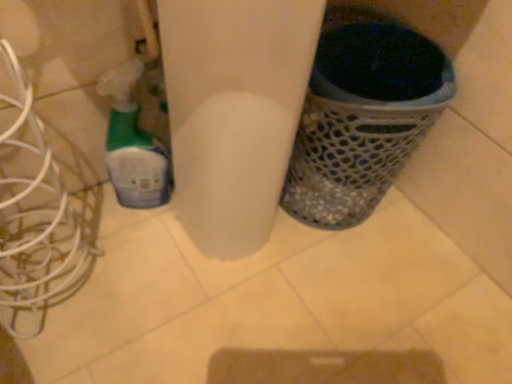
What do you see at coordinates (352, 156) in the screenshot? I see `metallic mesh waste bin at right` at bounding box center [352, 156].

The height and width of the screenshot is (384, 512). Find the location of `translucent plastic spray bottle at left`. translucent plastic spray bottle at left is located at coordinates [133, 143].

From the image's perspective, which one is positioned higher, translucent plastic spray bottle at left or metallic mesh waste bin at right?

metallic mesh waste bin at right.

Locate an element on the screen. This screenshot has width=512, height=384. waste container in front of the translucent plastic spray bottle at left is located at coordinates (352, 156).

Is point (111, 137) behind point (329, 200)?

That is False.

Which is more to the right, translucent plastic spray bottle at left or metallic mesh waste bin at right?

From the viewer's perspective, metallic mesh waste bin at right appears more on the right side.

From the picture: Is metallic mesh waste bin at right oriented towards white metallic wires at left?

No.

From a real-world perspective, which object stands above the other?

In real-world perspective, white metallic wires at left is above.

Based on the photo, is the surface of metallic mesh waste bin at right in direct contact with white metallic wires at left?

There is a gap between metallic mesh waste bin at right and white metallic wires at left.

Is metallic mesh waste bin at right thinner than white metallic wires at left?

In fact, metallic mesh waste bin at right might be wider than white metallic wires at left.

Considering the relative sizes of white metallic wires at left and metallic mesh waste bin at right in the image provided, is white metallic wires at left bigger than metallic mesh waste bin at right?

No.

Which of these two, white metallic wires at left or metallic mesh waste bin at right, stands shorter?

metallic mesh waste bin at right.

Are white metallic wires at left and metallic mesh waste bin at right located far from each other?

No, white metallic wires at left is not far from metallic mesh waste bin at right.

Considering the sizes of white metallic wires at left and translucent plastic spray bottle at left in the image, is white metallic wires at left bigger or smaller than translucent plastic spray bottle at left?

white metallic wires at left is bigger than translucent plastic spray bottle at left.

Is point (52, 269) farther from viewer compared to point (110, 144)?

Yes.

Is white metallic wires at left located outside translucent plastic spray bottle at left?

white metallic wires at left is positioned outside translucent plastic spray bottle at left.

Is white metallic wires at left facing away from translucent plastic spray bottle at left?

No.

Can you confirm if translucent plastic spray bottle at left is taller than white metallic wires at left?

In fact, translucent plastic spray bottle at left may be shorter than white metallic wires at left.

Is translucent plastic spray bottle at left directly adjacent to white metallic wires at left?

translucent plastic spray bottle at left and white metallic wires at left are not in contact.

The width and height of the screenshot is (512, 384). Identify the location of wire that is in front of the translucent plastic spray bottle at left. tap(35, 216).

Locate an element on the screen. This screenshot has height=384, width=512. waste container above the translucent plastic spray bottle at left (from a real-world perspective) is located at coordinates (352, 156).

Visually, is metallic mesh waste bin at right positioned to the left or to the right of translucent plastic spray bottle at left?

In the image, metallic mesh waste bin at right appears on the right side of translucent plastic spray bottle at left.

Considering the sizes of objects metallic mesh waste bin at right and translucent plastic spray bottle at left in the image provided, who is taller, metallic mesh waste bin at right or translucent plastic spray bottle at left?

Standing taller between the two is metallic mesh waste bin at right.

In the scene shown: Between metallic mesh waste bin at right and translucent plastic spray bottle at left, which one is positioned in front?

metallic mesh waste bin at right.

Find the location of a particular element. This screenshot has width=512, height=384. waste container in front of the translucent plastic spray bottle at left is located at coordinates (352, 156).

In the image, there is a white metallic wires at left. At what (x,y) coordinates should I click in order to perform the action: click on waste container below it (from a real-world perspective). Please return your answer as a coordinate pair (x, y). The width and height of the screenshot is (512, 384). Looking at the image, I should click on (352, 156).

Based on their spatial positions, is metallic mesh waste bin at right or white metallic wires at left closer to translucent plastic spray bottle at left?

The object closer to translucent plastic spray bottle at left is white metallic wires at left.

When comparing their distances from translucent plastic spray bottle at left, does white metallic wires at left or metallic mesh waste bin at right seem closer?

Based on the image, white metallic wires at left appears to be nearer to translucent plastic spray bottle at left.

Based on their spatial positions, is translucent plastic spray bottle at left or white metallic wires at left further from metallic mesh waste bin at right?

Based on the image, white metallic wires at left appears to be further to metallic mesh waste bin at right.

From the image, which object appears to be farther from white metallic wires at left, metallic mesh waste bin at right or translucent plastic spray bottle at left?

The object further to white metallic wires at left is metallic mesh waste bin at right.

Which object lies nearer to the anchor point metallic mesh waste bin at right, white metallic wires at left or translucent plastic spray bottle at left?

The object closer to metallic mesh waste bin at right is translucent plastic spray bottle at left.

When comparing their distances from white metallic wires at left, does translucent plastic spray bottle at left or metallic mesh waste bin at right seem further?

metallic mesh waste bin at right is further to white metallic wires at left.

This screenshot has height=384, width=512. What are the coordinates of `bottle between white metallic wires at left and metallic mesh waste bin at right` in the screenshot? It's located at (133, 143).